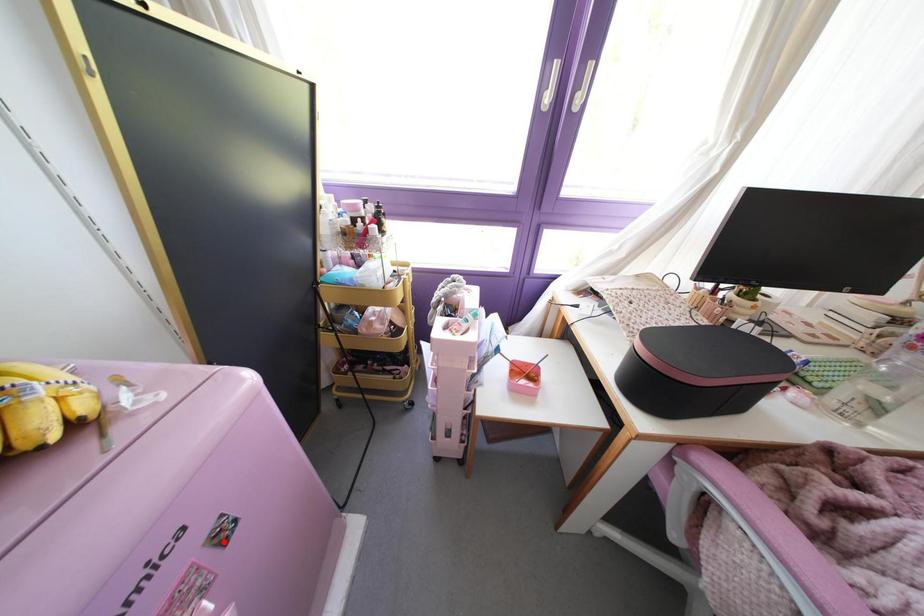
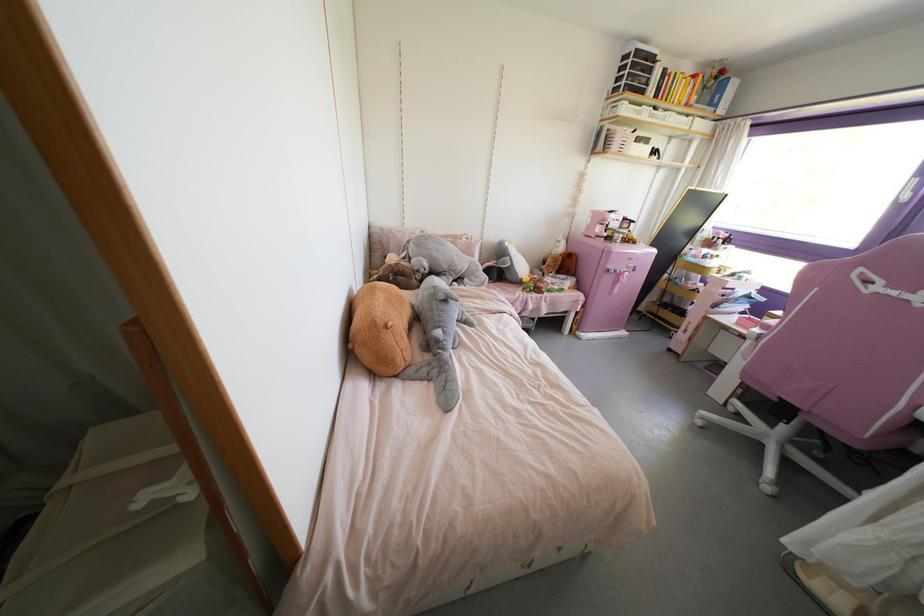
Question: I am providing you with two images of the same scene from different viewpoints. Image1 has a red point marked. In image2, the corresponding 3D location appears at what relative position? Reply with the corresponding letter.

Choices:
 (A) Closer
 (B) Farther

Answer: (A)